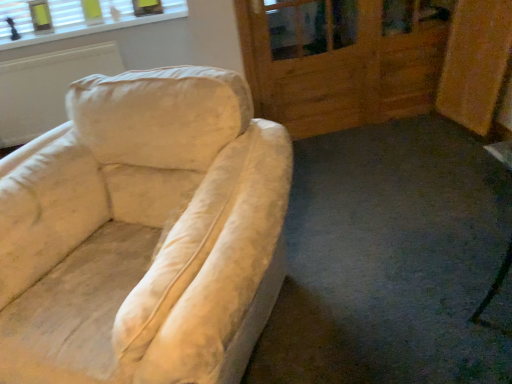
Question: Relative to wooden screen door at upper right, is white textured blinds at upper left in front or behind?

Choices:
 (A) front
 (B) behind

Answer: (B)

Question: Based on their sizes in the image, would you say white textured blinds at upper left is bigger or smaller than wooden screen door at upper right?

Choices:
 (A) big
 (B) small

Answer: (B)

Question: From their relative heights in the image, would you say white textured blinds at upper left is taller or shorter than wooden screen door at upper right?

Choices:
 (A) tall
 (B) short

Answer: (B)

Question: From the image's perspective, relative to white textured blinds at upper left, is wooden screen door at upper right above or below?

Choices:
 (A) above
 (B) below

Answer: (B)

Question: Considering their positions, is wooden screen door at upper right located in front of or behind white textured blinds at upper left?

Choices:
 (A) front
 (B) behind

Answer: (A)

Question: Considering the positions of point (309, 21) and point (115, 19), is point (309, 21) closer or farther from the camera than point (115, 19)?

Choices:
 (A) farther
 (B) closer

Answer: (A)

Question: In terms of width, does wooden screen door at upper right look wider or thinner when compared to white textured blinds at upper left?

Choices:
 (A) thin
 (B) wide

Answer: (B)